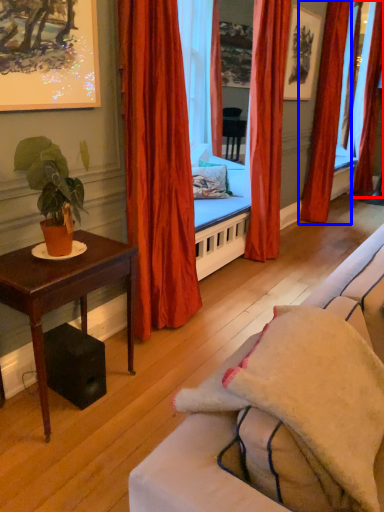
Question: Which of the following is the closest to the observer, curtain (highlighted by a red box) or curtain (highlighted by a blue box)?

Choices:
 (A) curtain
 (B) curtain

Answer: (B)